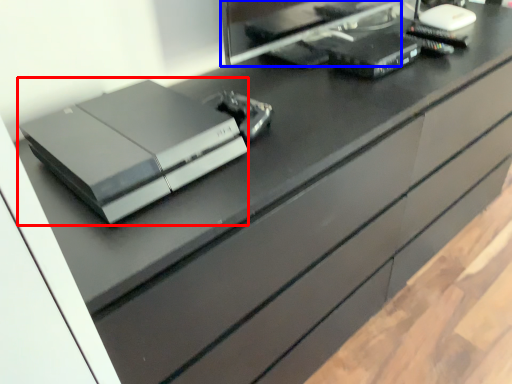
Question: Among these objects, which one is nearest to the camera, printer (highlighted by a red box) or desktop computer (highlighted by a blue box)?

Choices:
 (A) printer
 (B) desktop computer

Answer: (A)